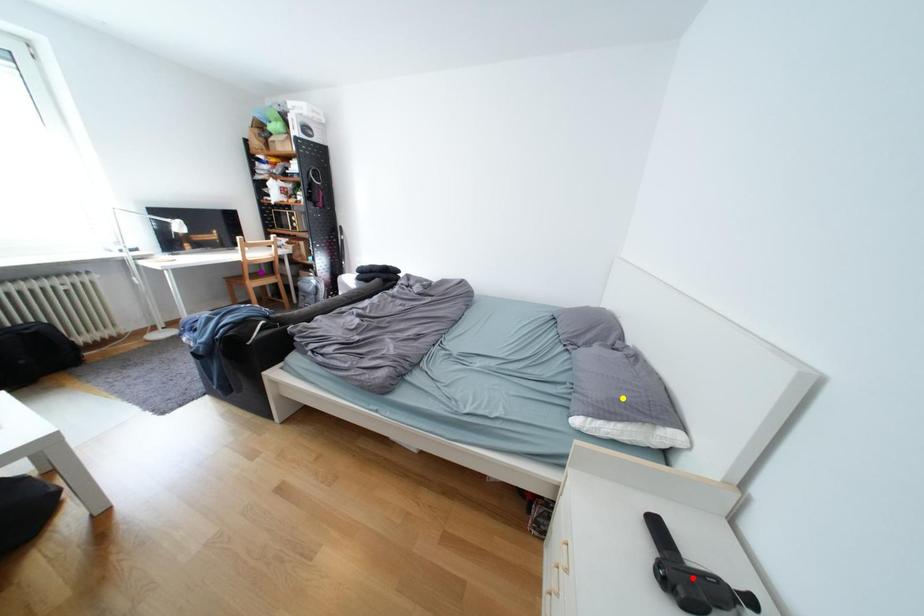
Order these from nearest to farthest:
yellow point, purple point, red point

red point < yellow point < purple point